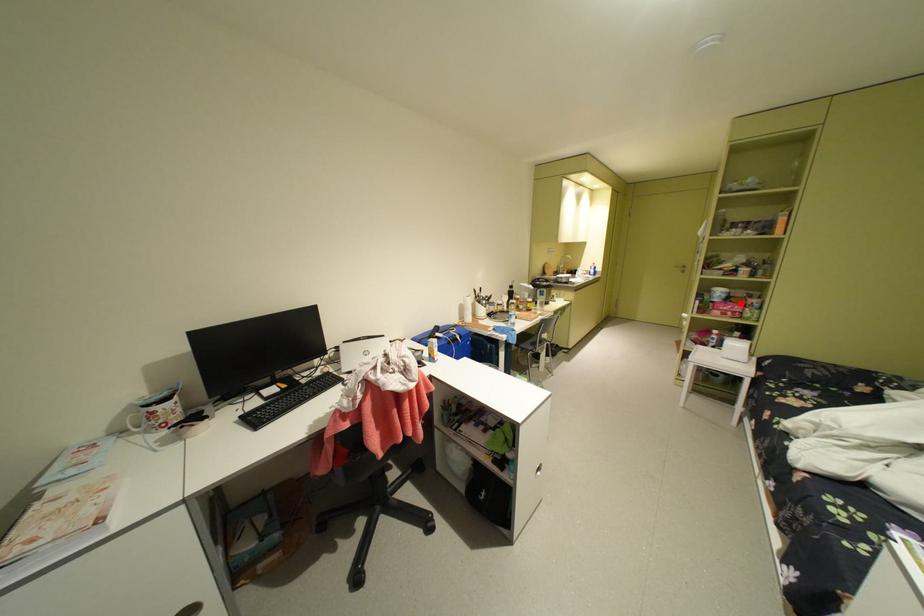
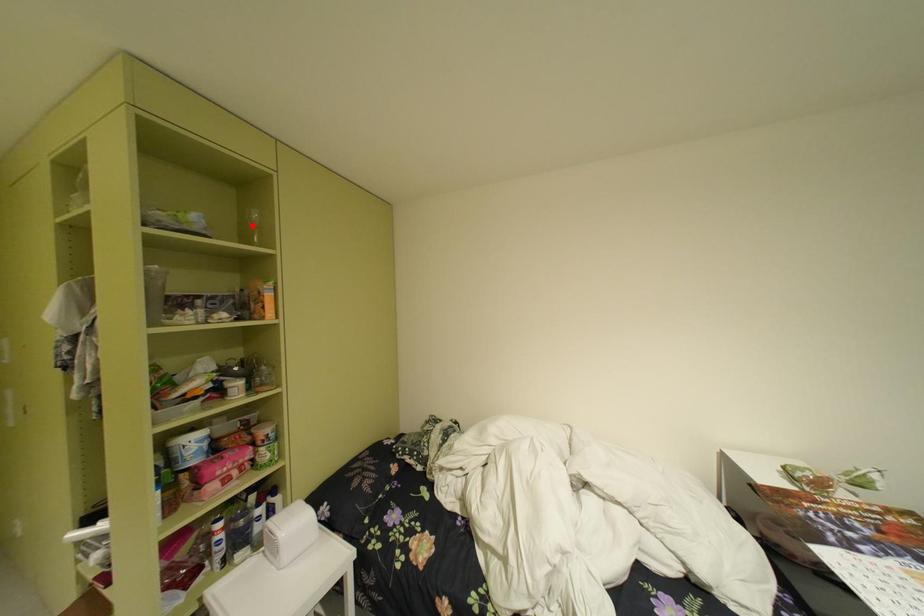
From the picture: I am providing you with two images of the same scene from different viewpoints. A red point is marked on the first image and another point is marked on the second image. Are the points marked in image1 and image2 representing the same 3D position?

No